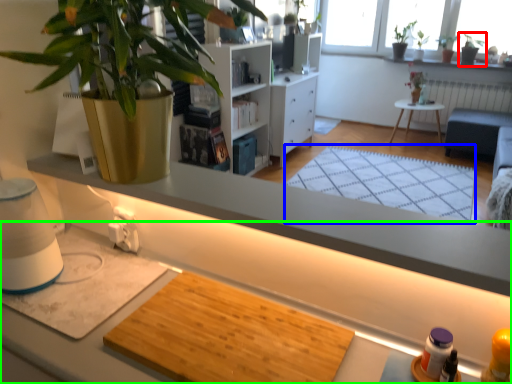
Question: Which is farther away from houseplant (highlighted by a red box)? mat (highlighted by a blue box) or desk (highlighted by a green box)?

Choices:
 (A) mat
 (B) desk

Answer: (B)